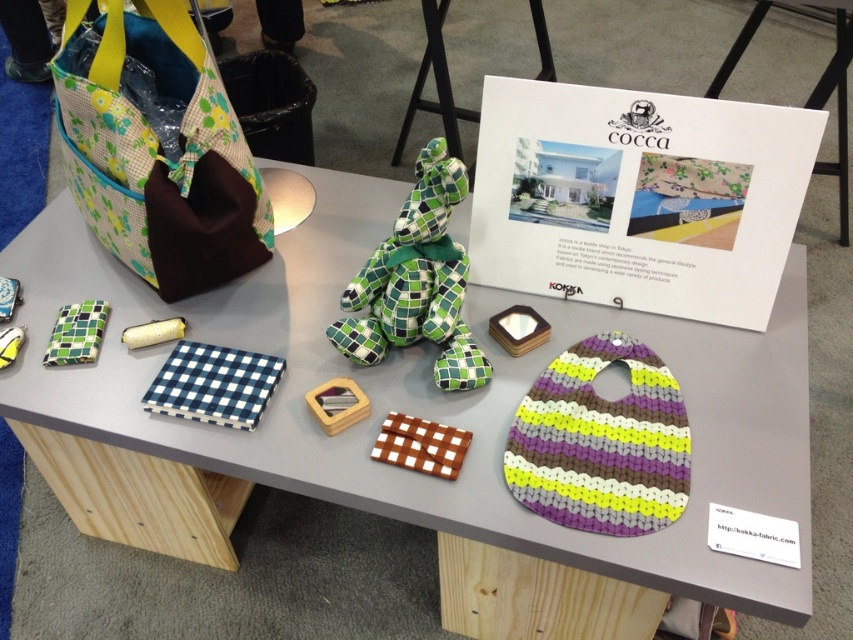
You are at a craft fair and see two items on the display table. The first is a blue checkered fabric at center and the second is a yellow fabric roll at center. Which one is positioned more to the right?

The blue checkered fabric at center is positioned more to the right than the yellow fabric roll at center.

You are organizing a craft fair booth and need to decide which item to place in a display case that can only accommodate larger items. Which item should you choose between the blue checkered fabric at center and the yellow fabric roll at center?

The blue checkered fabric at center has a larger size compared to the yellow fabric roll at center, so you should choose the blue checkered fabric at center for the display case.

You are a customer at the craft fair looking at the yellow fabric roll at center and the yellow fabric toy at center on the table. Which one is taller?

The yellow fabric toy at center is taller than the yellow fabric roll at center.